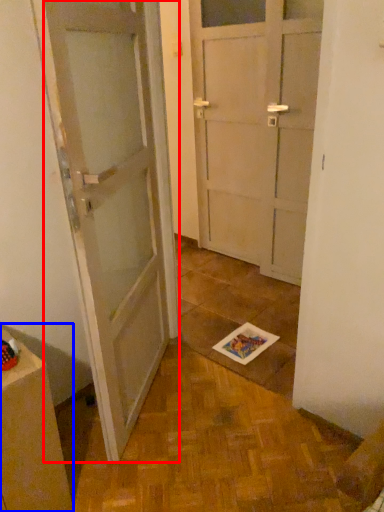
Question: Which object appears closest to the camera in this image, door (highlighted by a red box) or cabinetry (highlighted by a blue box)?

Choices:
 (A) door
 (B) cabinetry

Answer: (A)